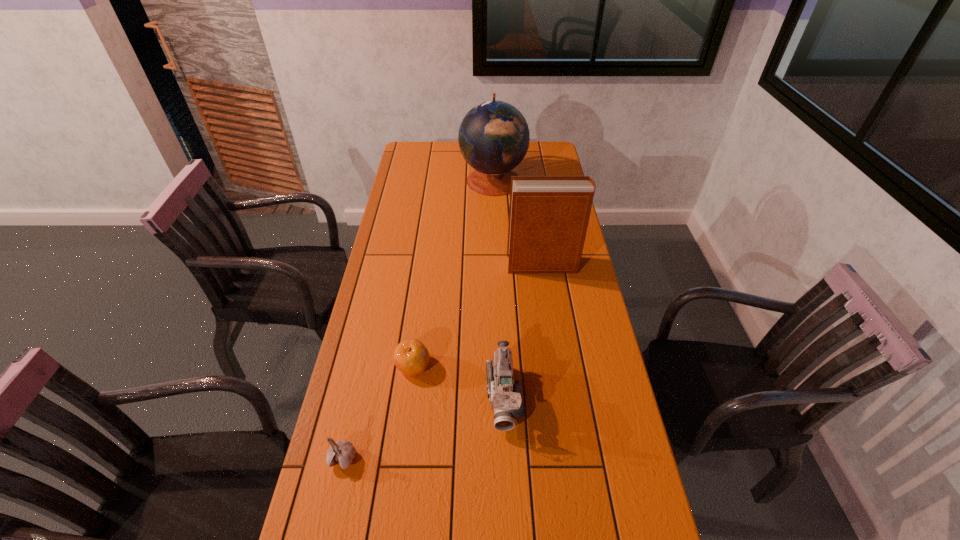
At what (x,y) coordinates should I click in order to perform the action: click on globe. Please return your answer as a coordinate pair (x, y). Looking at the image, I should click on (494, 137).

This screenshot has height=540, width=960. I want to click on the fourth nearest object, so click(548, 215).

Locate an element on the screen. This screenshot has height=540, width=960. camcorder is located at coordinates (504, 394).

Locate an element on the screen. The width and height of the screenshot is (960, 540). the leftmost object is located at coordinates (341, 452).

I want to click on garlic, so click(x=341, y=452).

You are a GUI agent. You are given a task and a screenshot of the screen. Output one action in this format:
    pyautogui.click(x=<x>, y=<y>)
    Task: Click on the clementine
    
    Given the screenshot: What is the action you would take?
    pyautogui.click(x=411, y=357)

I want to click on vacant space located with the Americas facing the viewer on the globe, so click(423, 180).

This screenshot has width=960, height=540. Find the location of `blank space located 0.120m with the Americas facing the viewer on the globe`. blank space located 0.120m with the Americas facing the viewer on the globe is located at coordinates (434, 180).

Locate an element on the screen. The width and height of the screenshot is (960, 540). vacant region located with the Americas facing the viewer on the globe is located at coordinates (417, 180).

Find the location of `vacant point located on the open cover of the second farthest object`. vacant point located on the open cover of the second farthest object is located at coordinates (469, 265).